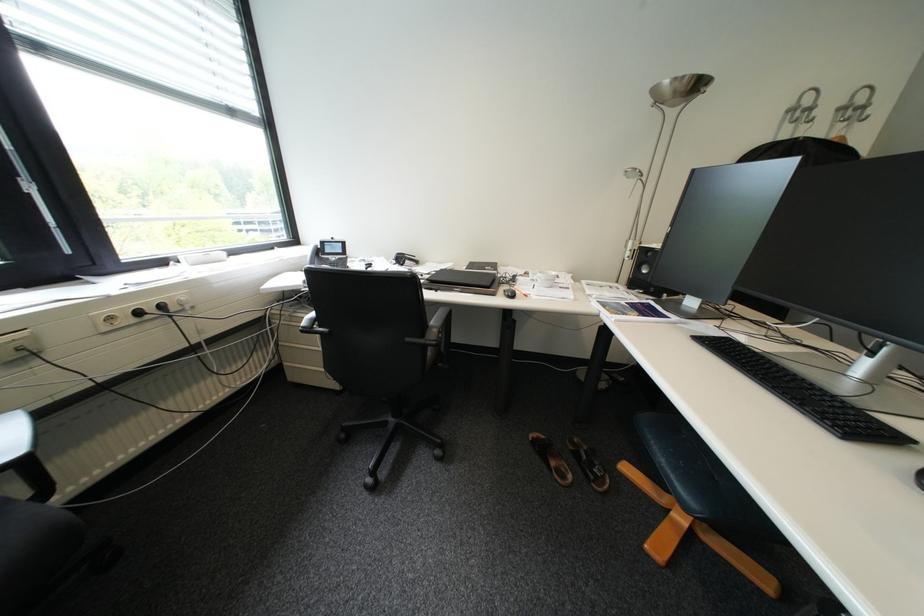
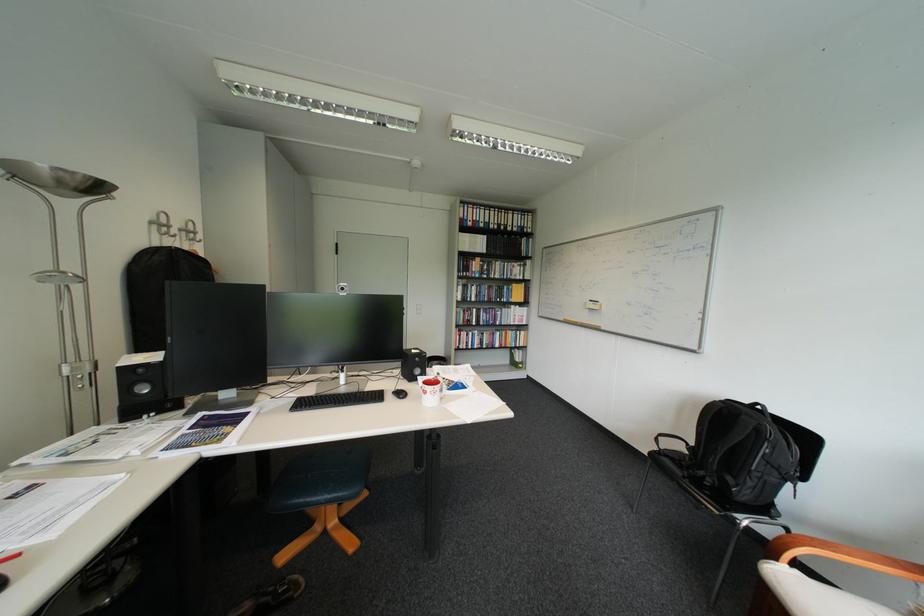
Locate, in the second image, the point that corresponds to (x=782, y=143) in the first image.

(160, 246)